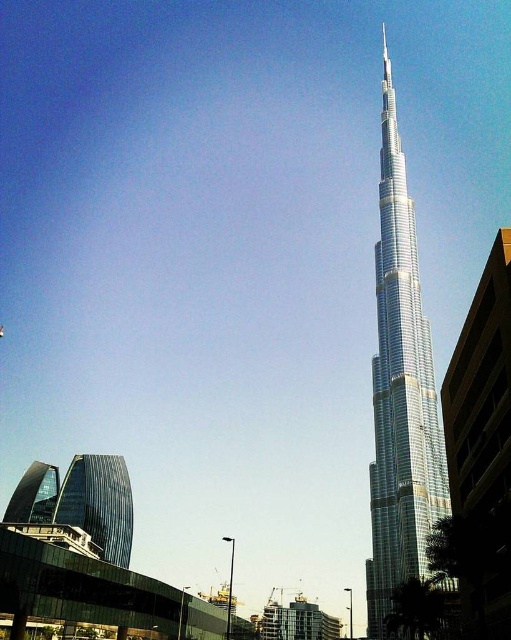
Question: Which of the following is the closest to the observer?

Choices:
 (A) (109, 541)
 (B) (409, 547)

Answer: (B)

Question: Does shiny glass skyscraper at right come in front of glassy reflective skyscraper at lower left?

Choices:
 (A) yes
 (B) no

Answer: (A)

Question: Does shiny glass skyscraper at right have a lesser width compared to glassy reflective skyscraper at lower left?

Choices:
 (A) no
 (B) yes

Answer: (A)

Question: Which point is farther to the camera?

Choices:
 (A) shiny glass skyscraper at right
 (B) glassy reflective skyscraper at lower left

Answer: (B)

Question: Can you confirm if shiny glass skyscraper at right is positioned below glassy reflective skyscraper at lower left?

Choices:
 (A) no
 (B) yes

Answer: (A)